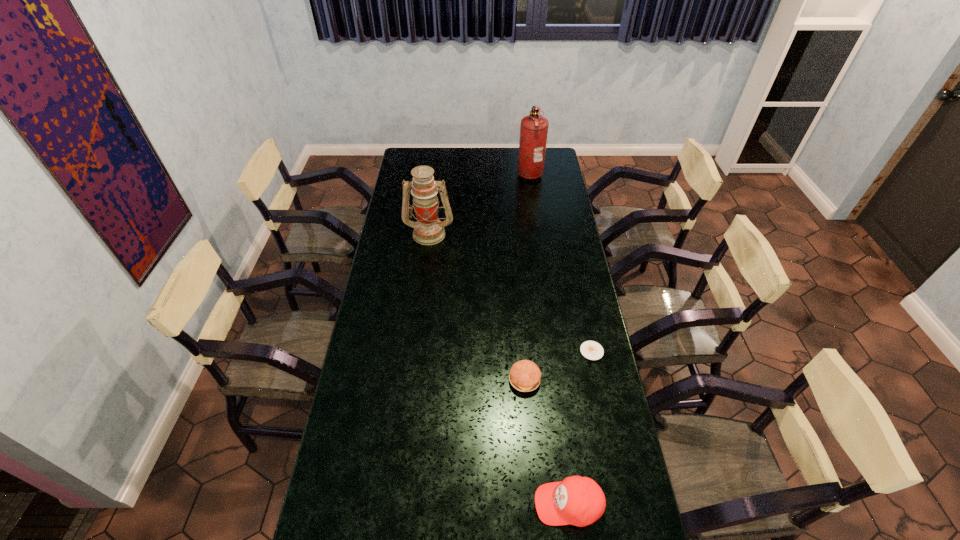
Locate an element on the screen. fire extinguisher at the right edge is located at coordinates (534, 128).

Identify the location of baseball cap that is at the right edge. This screenshot has height=540, width=960. (580, 501).

In order to click on egg yolk at the right edge in this screenshot , I will do `click(592, 350)`.

You are a GUI agent. You are given a task and a screenshot of the screen. Output one action in this format:
    pyautogui.click(x=<x>, y=<y>)
    Task: Click on the object present at the far right corner
    The height and width of the screenshot is (540, 960).
    Given the screenshot: What is the action you would take?
    (534, 128)

Image resolution: width=960 pixels, height=540 pixels. Identify the location of vacant area at the far edge of the desktop. pyautogui.click(x=461, y=161).

In the image, there is a desktop. Identify the location of vacant region at the left edge. The height and width of the screenshot is (540, 960). (383, 252).

In the image, there is a desktop. At what (x,y) coordinates should I click in order to perform the action: click on vacant space at the right edge. Please return your answer as a coordinate pair (x, y). Looking at the image, I should click on (551, 254).

Identify the location of vacant space at the far left corner of the desktop. This screenshot has width=960, height=540. (411, 153).

Locate an element on the screen. This screenshot has height=540, width=960. empty location between the egg yolk and the baseball cap is located at coordinates (580, 428).

The image size is (960, 540). Find the location of `free space between the leftmost object and the farthest object`. free space between the leftmost object and the farthest object is located at coordinates (479, 203).